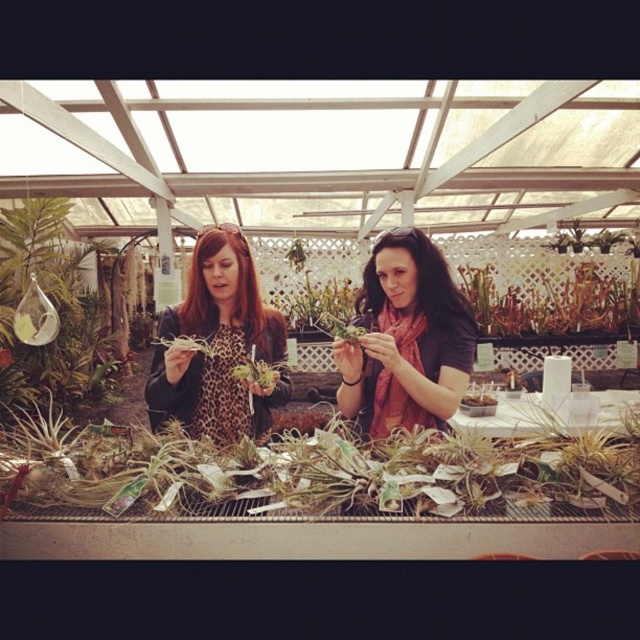
Question: Is leopard print jacket at center smaller than green matte plant at center?

Choices:
 (A) yes
 (B) no

Answer: (A)

Question: Is green leafy plant at center thinner than green matte plant at center?

Choices:
 (A) yes
 (B) no

Answer: (B)

Question: Does matte black scarf at center have a larger size compared to leopard print jacket at center?

Choices:
 (A) yes
 (B) no

Answer: (B)

Question: Which point is closer to the camera taking this photo?

Choices:
 (A) (205, 465)
 (B) (177, 408)

Answer: (A)

Question: Among these points, which one is nearest to the camera?

Choices:
 (A) pos(333,282)
 (B) pos(444,372)

Answer: (B)

Question: Among these points, which one is farthest from the camera?

Choices:
 (A) (296, 332)
 (B) (483, 465)

Answer: (A)